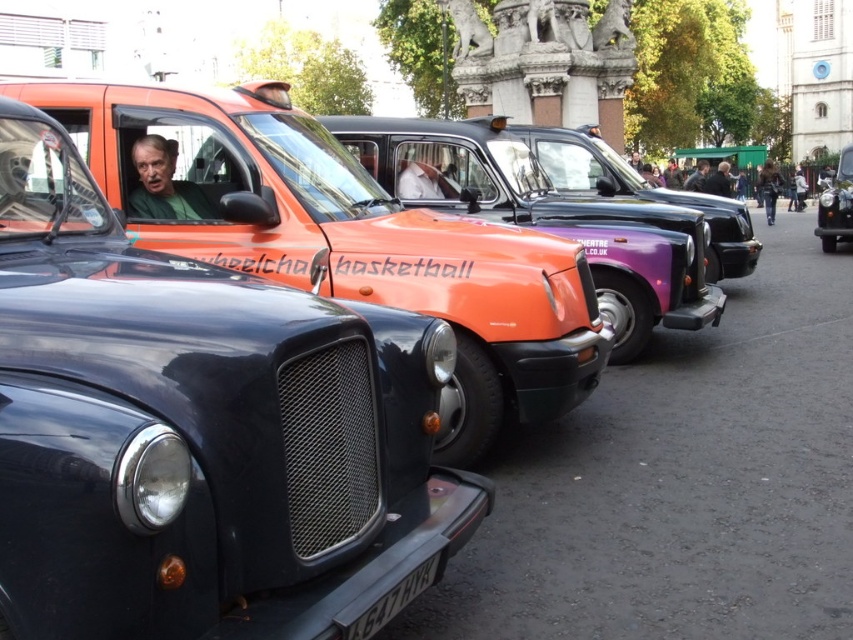
Question: Which is farther from the denim jacket at lower right?

Choices:
 (A) shiny black taxi at right
 (B) orange matte taxi at center
 (C) green fabric shirt at center

Answer: (C)

Question: Is shiny orange taxi at center above denim jacket at lower right?

Choices:
 (A) yes
 (B) no

Answer: (B)

Question: Among these points, which one is farthest from the camera?

Choices:
 (A) (398, 177)
 (B) (485, 172)
 (C) (228, 150)
 (D) (160, 216)

Answer: (A)

Question: Among these objects, which one is nearest to the camera?

Choices:
 (A) orange matte taxi at center
 (B) shiny black taxi at right
 (C) white shirt at center

Answer: (A)

Question: Can you confirm if orange matte taxi at center is positioned to the left of denim jacket at lower right?

Choices:
 (A) no
 (B) yes

Answer: (B)

Question: Does shiny orange taxi at center appear on the right side of black plastic license plate at lower center?

Choices:
 (A) yes
 (B) no

Answer: (B)